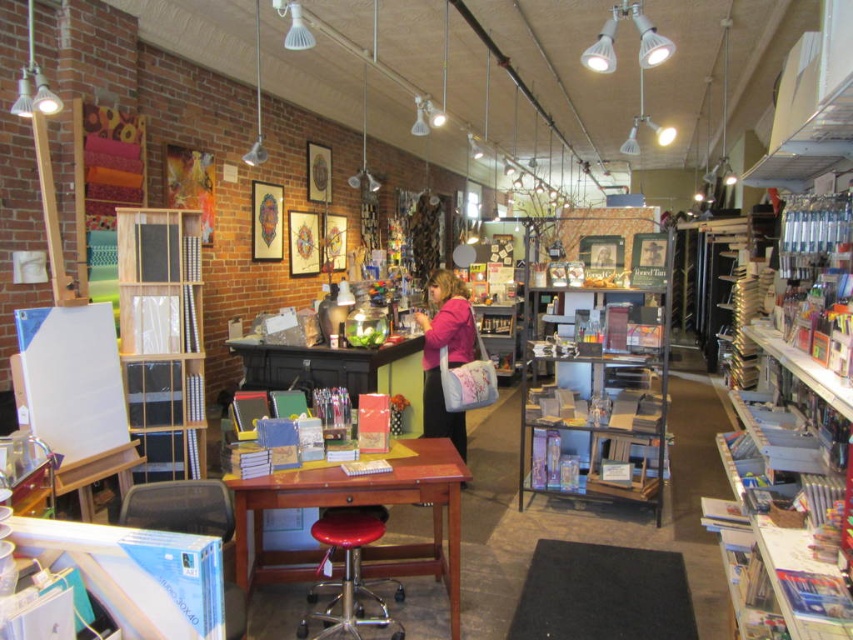
Question: Among these objects, which one is nearest to the camera?

Choices:
 (A) pink fabric purse at center
 (B) metallic gray bookshelf at center
 (C) white cardboard bookshelf at right
 (D) wooden bookshelf at left

Answer: (C)

Question: In this image, where is white cardboard bookshelf at right located relative to metallic silver light fixture at upper left?

Choices:
 (A) below
 (B) above

Answer: (A)

Question: Which point is closer to the camera?

Choices:
 (A) pink fabric purse at center
 (B) white cardboard bookshelf at right
 (C) red leather stool at center

Answer: (B)

Question: Based on their relative distances, which object is farther from the metallic gray bookshelf at center?

Choices:
 (A) red leather stool at center
 (B) white cardboard bookshelf at right
 (C) metallic silver light fixture at upper left

Answer: (C)

Question: Is wooden bookshelf at left positioned in front of metallic silver light fixture at upper left?

Choices:
 (A) yes
 (B) no

Answer: (B)

Question: Can you confirm if white cardboard bookshelf at right is positioned above red leather stool at center?

Choices:
 (A) no
 (B) yes

Answer: (B)